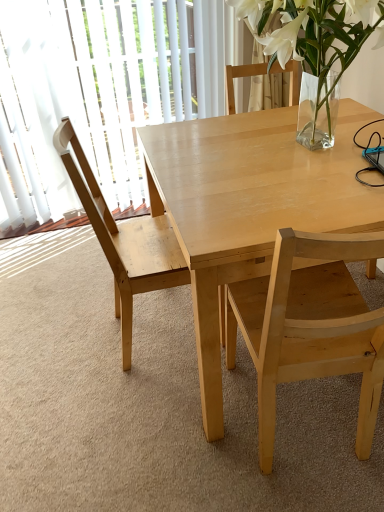
This screenshot has width=384, height=512. Identify the location of vacant space positioned to the left of light wood chair at left, which is counted as the 2th chair, starting from the right. (65, 339).